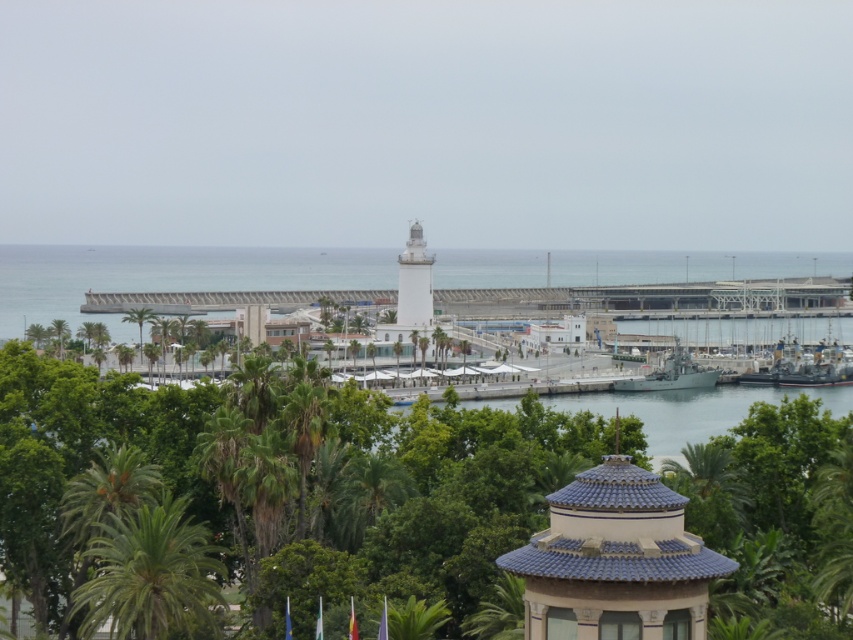
Question: Which is nearer to the white smooth tower at center?

Choices:
 (A) green leafy palm tree at lower left
 (B) green leafy palm tree at center
 (C) green metallic ship at center

Answer: (C)

Question: Estimate the real-world distances between objects in this image. Which object is closer to the white smooth tower at center?

Choices:
 (A) green leafy palm tree at lower left
 (B) metallic gray ship at lower right
 (C) green leafy palm tree at center
 (D) green metallic ship at center

Answer: (D)

Question: Is green leafy palm tree at center to the left of white smooth tower at center from the viewer's perspective?

Choices:
 (A) yes
 (B) no

Answer: (A)

Question: Where is green leafy tree at center located in relation to metallic gray ship at lower right in the image?

Choices:
 (A) right
 (B) left

Answer: (B)

Question: Can you confirm if metallic gray ship at lower right is wider than green metallic ship at center?

Choices:
 (A) yes
 (B) no

Answer: (A)

Question: Which point is closer to the camera?

Choices:
 (A) green leafy palm tree at lower left
 (B) white smooth tower at center
 (C) metallic gray ship at lower right
 (D) white smooth lighthouse at center

Answer: (A)